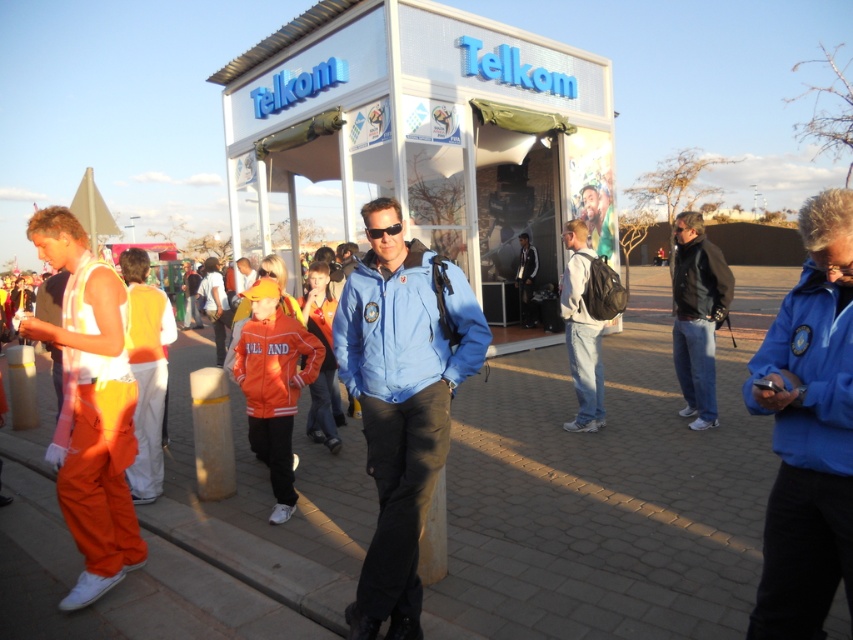
You are a photographer trying to capture both the blue fabric jacket at center and the gray matte jacket at center in a single frame. Based on their positions, which jacket should you focus on first to ensure both are in the shot?

The blue fabric jacket at center is located below the gray matte jacket at center, so you should focus on the gray matte jacket at center first to ensure both are in the shot.

You are standing at the point labeled point (398,365) and want to walk to the point labeled point (561,308). Which direction should you move relative to the camera?

You should move away from the camera because point (561,308) is further from the camera than point (398,365).

You are a photographer trying to capture a photo of the brick pavement at center and denim jeans at center. Based on their positions, which object should you focus on first to ensure both are in the frame?

The brick pavement at center is in front of denim jeans at center, so you should focus on the brick pavement at center first to ensure both are in the frame.